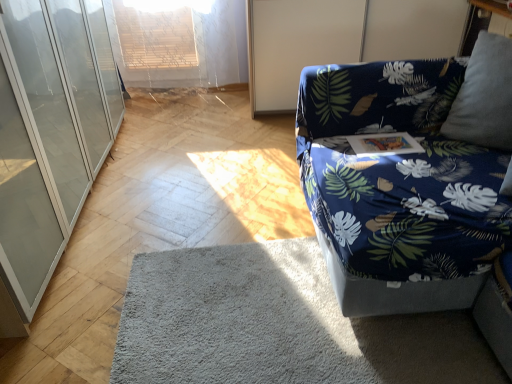
At what (x,y) coordinates should I click in order to perform the action: click on free region under gray soft rug at lower center (from a real-world perspective). Please return your answer as a coordinate pair (x, y). The width and height of the screenshot is (512, 384). Looking at the image, I should click on (257, 313).